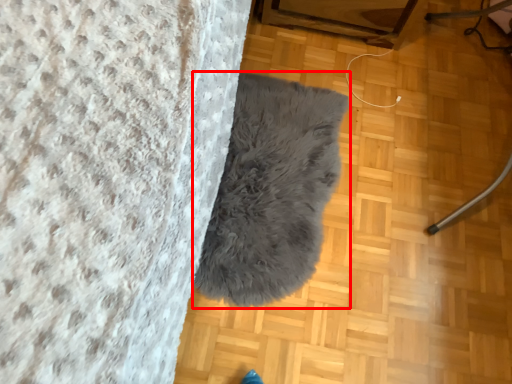
Question: From the image's perspective, what is the correct spatial positioning of blanket (annotated by the red box) in reference to furniture?

Choices:
 (A) above
 (B) below

Answer: (B)